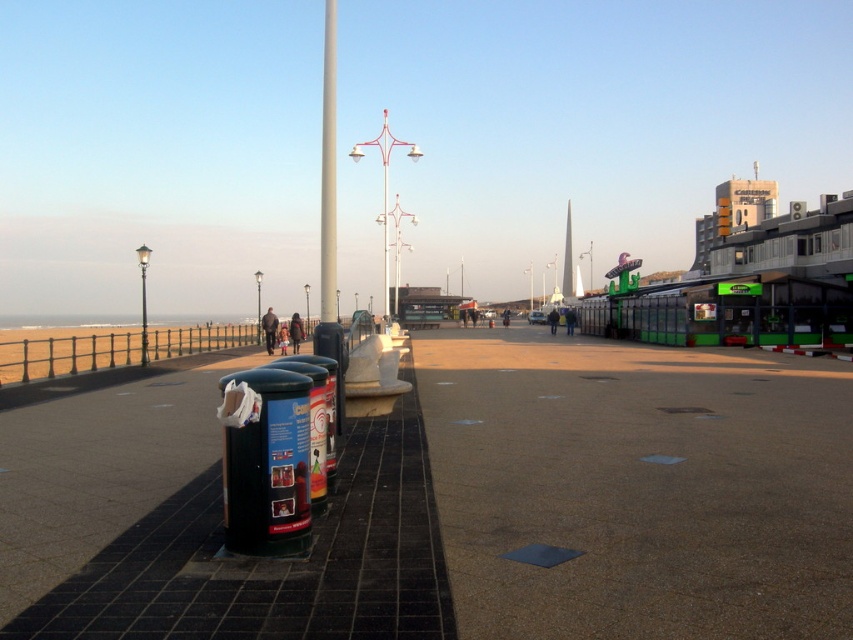
Between point (534, 577) and point (328, 136), which one is positioned behind?

The point (328, 136) is behind.

Based on the photo, does brown textured pavement at center lie behind metallic pole at center?

That is False.

Locate an element on the screen. Image resolution: width=853 pixels, height=640 pixels. brown textured pavement at center is located at coordinates (637, 486).